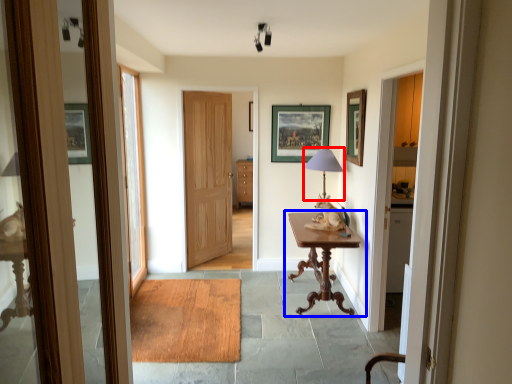
Question: Among these objects, which one is farthest to the camera, table lamp (highlighted by a red box) or table (highlighted by a blue box)?

Choices:
 (A) table lamp
 (B) table

Answer: (A)